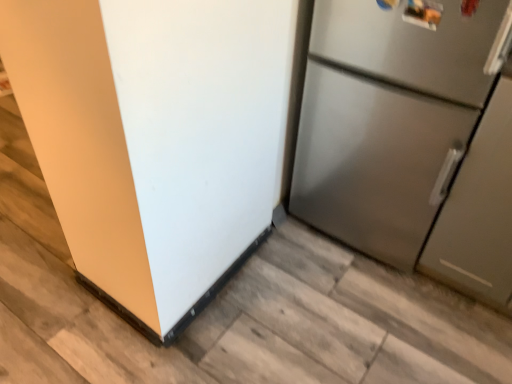
Question: Is the position of satin silver refrigerator at right, placed as the second refrigerator when sorted from left to right, less distant than that of stainless steel refrigerator at right, positioned as the 1th refrigerator in left-to-right order?

Choices:
 (A) yes
 (B) no

Answer: (B)

Question: From a real-world perspective, is satin silver refrigerator at right, acting as the 1th refrigerator starting from the right, on stainless steel refrigerator at right, positioned as the 1th refrigerator in left-to-right order?

Choices:
 (A) yes
 (B) no

Answer: (A)

Question: Is satin silver refrigerator at right, placed as the second refrigerator when sorted from left to right, outside of stainless steel refrigerator at right, the second refrigerator in the right-to-left sequence?

Choices:
 (A) yes
 (B) no

Answer: (A)

Question: Is satin silver refrigerator at right, acting as the 1th refrigerator starting from the right, facing away from stainless steel refrigerator at right, positioned as the 1th refrigerator in left-to-right order?

Choices:
 (A) yes
 (B) no

Answer: (B)

Question: Does satin silver refrigerator at right, acting as the 1th refrigerator starting from the right, have a smaller size compared to stainless steel refrigerator at right, positioned as the 1th refrigerator in left-to-right order?

Choices:
 (A) no
 (B) yes

Answer: (A)

Question: Considering the relative positions of satin silver refrigerator at right, placed as the second refrigerator when sorted from left to right, and stainless steel refrigerator at right, positioned as the 1th refrigerator in left-to-right order, in the image provided, is satin silver refrigerator at right, placed as the second refrigerator when sorted from left to right, to the left of stainless steel refrigerator at right, positioned as the 1th refrigerator in left-to-right order, from the viewer's perspective?

Choices:
 (A) no
 (B) yes

Answer: (A)

Question: Is the depth of stainless steel refrigerator at right, the second refrigerator in the right-to-left sequence, less than that of satin silver refrigerator at right, placed as the second refrigerator when sorted from left to right?

Choices:
 (A) no
 (B) yes

Answer: (B)

Question: Is stainless steel refrigerator at right, the second refrigerator in the right-to-left sequence, surrounding satin silver refrigerator at right, acting as the 1th refrigerator starting from the right?

Choices:
 (A) yes
 (B) no

Answer: (B)

Question: Can you confirm if stainless steel refrigerator at right, positioned as the 1th refrigerator in left-to-right order, is positioned to the right of satin silver refrigerator at right, placed as the second refrigerator when sorted from left to right?

Choices:
 (A) no
 (B) yes

Answer: (A)

Question: Can you confirm if stainless steel refrigerator at right, the second refrigerator in the right-to-left sequence, is bigger than satin silver refrigerator at right, acting as the 1th refrigerator starting from the right?

Choices:
 (A) yes
 (B) no

Answer: (B)

Question: Can you confirm if stainless steel refrigerator at right, the second refrigerator in the right-to-left sequence, is wider than satin silver refrigerator at right, acting as the 1th refrigerator starting from the right?

Choices:
 (A) no
 (B) yes

Answer: (B)

Question: Does stainless steel refrigerator at right, the second refrigerator in the right-to-left sequence, have a lesser height compared to satin silver refrigerator at right, placed as the second refrigerator when sorted from left to right?

Choices:
 (A) no
 (B) yes

Answer: (B)

Question: Is point (434, 81) positioned closer to the camera than point (18, 71)?

Choices:
 (A) closer
 (B) farther

Answer: (B)